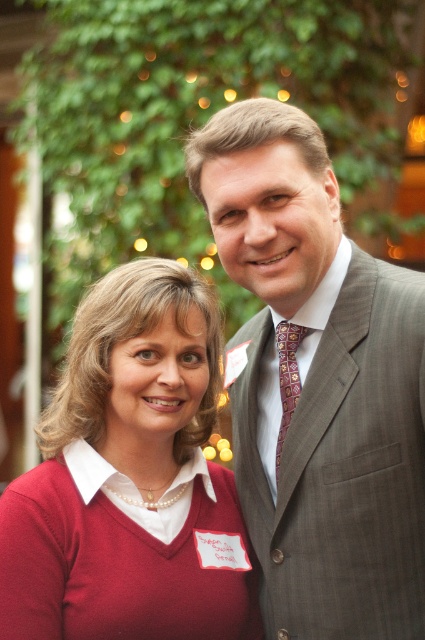
Question: Observing the image, what is the correct spatial positioning of matte red sweater at left in reference to patterned silk tie at center?

Choices:
 (A) right
 (B) left

Answer: (B)

Question: Which of the following is the farthest from the observer?

Choices:
 (A) patterned silk tie at center
 (B) matte red sweater at left
 (C) gray suit at center

Answer: (A)

Question: Among these points, which one is farthest from the camera?

Choices:
 (A) (416, 300)
 (B) (283, 355)

Answer: (B)

Question: Which point appears closest to the camera in this image?

Choices:
 (A) (319, 200)
 (B) (155, 515)
 (C) (275, 340)

Answer: (A)

Question: Does matte red sweater at left have a smaller size compared to patterned silk tie at center?

Choices:
 (A) yes
 (B) no

Answer: (B)

Question: Can you confirm if gray suit at center is thinner than matte red sweater at left?

Choices:
 (A) yes
 (B) no

Answer: (A)